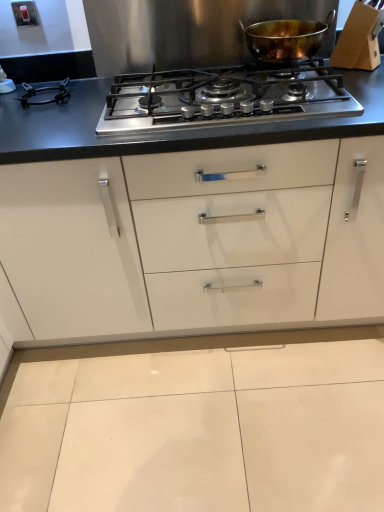
What is the approximate height of shiny copper pot at upper center?

It is 5.71 inches.

What do you see at coordinates (286, 39) in the screenshot?
I see `shiny copper pot at upper center` at bounding box center [286, 39].

I want to click on shiny copper pot at upper center, so click(x=286, y=39).

Describe the element at coordinates (165, 132) in the screenshot. This screenshot has height=512, width=384. I see `stainless steel gas stove at center` at that location.

You are a GUI agent. You are given a task and a screenshot of the screen. Output one action in this format:
    pyautogui.click(x=<x>, y=<y>)
    Task: Click on the stainless steel gas stove at center
    This screenshot has height=512, width=384.
    Given the screenshot: What is the action you would take?
    click(165, 132)

This screenshot has height=512, width=384. Identify the location of shiny copper pot at upper center. (286, 39).

Considering the relative positions of stainless steel gas stove at center and shiny copper pot at upper center in the image provided, is stainless steel gas stove at center to the left of shiny copper pot at upper center from the viewer's perspective?

Yes, stainless steel gas stove at center is to the left of shiny copper pot at upper center.

Is the position of stainless steel gas stove at center less distant than that of shiny copper pot at upper center?

Yes, it is.

Is point (382, 97) farther from camera compared to point (314, 31)?

No, it is in front of (314, 31).

From the image's perspective, is stainless steel gas stove at center located above or below shiny copper pot at upper center?

stainless steel gas stove at center is situated lower than shiny copper pot at upper center in the image.

From a real-world perspective, between stainless steel gas stove at center and shiny copper pot at upper center, who is vertically higher?

From a 3D spatial view, shiny copper pot at upper center is above.

Which object is thinner, stainless steel gas stove at center or shiny copper pot at upper center?

With smaller width is shiny copper pot at upper center.

Can you confirm if stainless steel gas stove at center is taller than shiny copper pot at upper center?

No.

Can you confirm if stainless steel gas stove at center is smaller than shiny copper pot at upper center?

Incorrect, stainless steel gas stove at center is not smaller in size than shiny copper pot at upper center.

In the scene shown: Is stainless steel gas stove at center spatially inside shiny copper pot at upper center, or outside of it?

stainless steel gas stove at center is outside shiny copper pot at upper center.

Can you see stainless steel gas stove at center touching shiny copper pot at upper center?

No, stainless steel gas stove at center is not touching shiny copper pot at upper center.

Could you tell me if stainless steel gas stove at center is facing shiny copper pot at upper center?

No, stainless steel gas stove at center is not turned towards shiny copper pot at upper center.

Measure the distance between stainless steel gas stove at center and shiny copper pot at upper center.

stainless steel gas stove at center is 15.45 inches away from shiny copper pot at upper center.

Find the location of a particular element. This screenshot has width=384, height=512. countertop in front of the shiny copper pot at upper center is located at coordinates (165, 132).

Does shiny copper pot at upper center appear on the right side of stainless steel gas stove at center?

Yes, shiny copper pot at upper center is to the right of stainless steel gas stove at center.

Considering the relative positions of shiny copper pot at upper center and stainless steel gas stove at center in the image provided, is shiny copper pot at upper center in front of stainless steel gas stove at center?

No, it is not.

Which is further, (259, 34) or (53, 113)?

The point (259, 34) is farther from the camera.

From the image's perspective, which is above, shiny copper pot at upper center or stainless steel gas stove at center?

From the image's view, shiny copper pot at upper center is above.

From a real-world perspective, is shiny copper pot at upper center under stainless steel gas stove at center?

Actually, shiny copper pot at upper center is physically above stainless steel gas stove at center in the real world.

Does shiny copper pot at upper center have a greater width compared to stainless steel gas stove at center?

Incorrect, the width of shiny copper pot at upper center does not surpass that of stainless steel gas stove at center.

Does shiny copper pot at upper center have a lesser height compared to stainless steel gas stove at center?

No.

Considering the relative sizes of shiny copper pot at upper center and stainless steel gas stove at center in the image provided, is shiny copper pot at upper center bigger than stainless steel gas stove at center?

Actually, shiny copper pot at upper center might be smaller than stainless steel gas stove at center.

In the scene shown: Is shiny copper pot at upper center inside or outside of stainless steel gas stove at center?

shiny copper pot at upper center lies outside stainless steel gas stove at center.

Are shiny copper pot at upper center and stainless steel gas stove at center located far from each other?

They are positioned close to each other.

Could you tell me if shiny copper pot at upper center is facing stainless steel gas stove at center?

No, shiny copper pot at upper center is not facing towards stainless steel gas stove at center.

How far apart are shiny copper pot at upper center and stainless steel gas stove at center?

A distance of 39.24 centimeters exists between shiny copper pot at upper center and stainless steel gas stove at center.

Identify the location of kitchen appliance above the stainless steel gas stove at center (from a real-world perspective). point(286,39).

The height and width of the screenshot is (512, 384). Identify the location of kitchen appliance that appears on the right of stainless steel gas stove at center. (286, 39).

At what (x,y) coordinates should I click in order to perform the action: click on countertop on the left of the shiny copper pot at upper center. Please return your answer as a coordinate pair (x, y). Looking at the image, I should click on (165, 132).